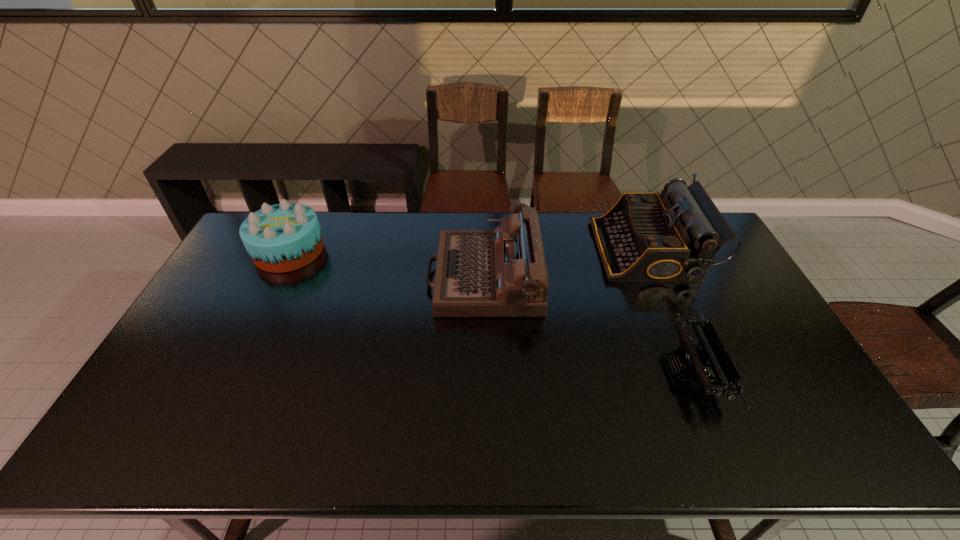
Where is `blank space at the near left corner`? This screenshot has width=960, height=540. blank space at the near left corner is located at coordinates (159, 437).

Find the location of a particular element. The image size is (960, 540). vacant space that's between the leftmost object and the leftmost typewriter is located at coordinates (386, 264).

Image resolution: width=960 pixels, height=540 pixels. I want to click on free area in between the second object from left to right and the shortest typewriter, so click(588, 325).

Find the location of a particular element. blank region between the leftmost object and the third object from right to left is located at coordinates [386, 264].

Locate an element on the screen. free space between the cake and the leftmost typewriter is located at coordinates (386, 264).

You are a GUI agent. You are given a task and a screenshot of the screen. Output one action in this format:
    pyautogui.click(x=<x>, y=<y>)
    Task: Click on the vacant area between the second object from left to right and the second shortest object
    This screenshot has height=540, width=960.
    Given the screenshot: What is the action you would take?
    pyautogui.click(x=386, y=264)

The image size is (960, 540). What are the coordinates of `object that stands as the second closest to the shortest object` in the screenshot? It's located at (478, 273).

I want to click on object identified as the closest to the leftmost object, so point(478,273).

The height and width of the screenshot is (540, 960). Identify the location of typewriter that is the closest to the third object from right to left. (645, 236).

You are a GUI agent. You are given a task and a screenshot of the screen. Output one action in this format:
    pyautogui.click(x=<x>, y=<y>)
    Task: Click on the second closest typewriter to the shortest object
    The width and height of the screenshot is (960, 540).
    Given the screenshot: What is the action you would take?
    pyautogui.click(x=478, y=273)